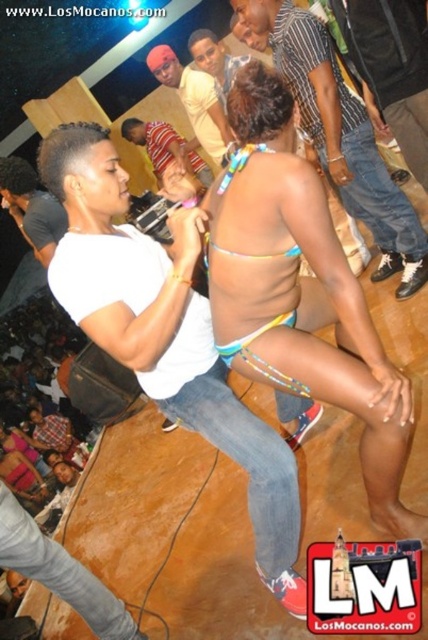
Who is more forward, [330,282] or [201,179]?

Positioned in front is point [330,282].

In the scene shown: Can you confirm if multicolored fabric bikini top at center is positioned below striped jersey at center?

Yes, multicolored fabric bikini top at center is below striped jersey at center.

Find the location of `multicolored fabric bikini top at center`. multicolored fabric bikini top at center is located at coordinates (300, 291).

Find the location of `multicolored fabric bikini top at center`. multicolored fabric bikini top at center is located at coordinates (300, 291).

Is multicolored fabric bikini top at center wider than multicolored string bikini at center?

In fact, multicolored fabric bikini top at center might be narrower than multicolored string bikini at center.

Is point (318, 186) positioned after point (74, 216)?

No, (318, 186) is closer to viewer.

Image resolution: width=428 pixels, height=640 pixels. What are the coordinates of `multicolored fabric bikini top at center` in the screenshot? It's located at (300, 291).

Is striped shirt at upper center closer to camera compared to matte yellow shirt at upper center?

That is True.

Which is below, striped shirt at upper center or matte yellow shirt at upper center?

Positioned lower is striped shirt at upper center.

Which is in front, point (421, 276) or point (196, 70)?

Point (421, 276) is more forward.

Identify the location of striped shirt at upper center. (341, 136).